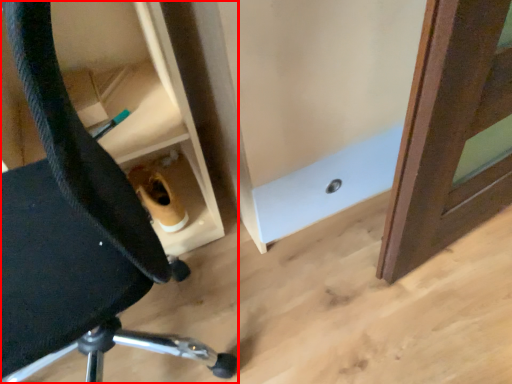
Question: From the image, what is the correct spatial relationship of chair (annotated by the red box) in relation to cabinetry?

Choices:
 (A) left
 (B) right

Answer: (A)